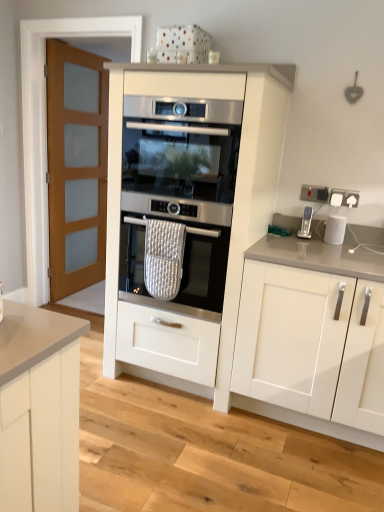
What do you see at coordinates (187, 211) in the screenshot? I see `white matte oven at center, which ranks as the 2th cabinetry in right-to-left order` at bounding box center [187, 211].

In order to face satin silver oven at center, placed as the second oven when sorted from top to bottom, should I rotate leftwards or rightwards?

A 0.328 degree turn to the left will do.

What is the approximate height of white matte cabinet at right, the 2th cabinetry from the left?

It is 38.81 inches.

Identify the location of white matte oven at center, the 1th cabinetry when ordered from left to right. click(187, 211).

From the image's perspective, is stainless steel oven at center, which is the second oven in bottom-to-top order, on white matte cabinet at right, the 2th cabinetry from the left?

Indeed, from the image's perspective, stainless steel oven at center, which is the second oven in bottom-to-top order, is shown above white matte cabinet at right, the 2th cabinetry from the left.

Visually, is stainless steel oven at center, which is the second oven in bottom-to-top order, positioned to the left or to the right of white matte cabinet at right, the 2th cabinetry from the left?

Clearly, stainless steel oven at center, which is the second oven in bottom-to-top order, is on the left of white matte cabinet at right, the 2th cabinetry from the left, in the image.

Between stainless steel oven at center, arranged as the 1th oven when viewed from the top, and white matte cabinet at right, the 2th cabinetry from the left, which one is positioned behind?

stainless steel oven at center, arranged as the 1th oven when viewed from the top, is further from the camera.

Can you confirm if white glossy kettle at upper right is positioned to the left of white matte oven at center, the 1th cabinetry when ordered from left to right?

No, white glossy kettle at upper right is not to the left of white matte oven at center, the 1th cabinetry when ordered from left to right.

Based on the photo, can you see white glossy kettle at upper right touching white matte oven at center, which ranks as the 2th cabinetry in right-to-left order?

They are not placed beside each other.

Does white glossy kettle at upper right have a smaller size compared to white matte oven at center, which ranks as the 2th cabinetry in right-to-left order?

Indeed, white glossy kettle at upper right has a smaller size compared to white matte oven at center, which ranks as the 2th cabinetry in right-to-left order.

How many degrees apart are the facing directions of white matte oven at center, the 1th cabinetry when ordered from left to right, and stainless steel oven at center, which is the second oven in bottom-to-top order?

There is a 0.797-degree angle between the facing directions of white matte oven at center, the 1th cabinetry when ordered from left to right, and stainless steel oven at center, which is the second oven in bottom-to-top order.

Are white matte oven at center, the 1th cabinetry when ordered from left to right, and stainless steel oven at center, which is the second oven in bottom-to-top order, located far from each other?

No, white matte oven at center, the 1th cabinetry when ordered from left to right, is in close proximity to stainless steel oven at center, which is the second oven in bottom-to-top order.

Which of these two, white matte oven at center, which ranks as the 2th cabinetry in right-to-left order, or stainless steel oven at center, arranged as the 1th oven when viewed from the top, is wider?

stainless steel oven at center, arranged as the 1th oven when viewed from the top, is wider.

From the image's perspective, which is above, white matte oven at center, the 1th cabinetry when ordered from left to right, or stainless steel oven at center, which is the second oven in bottom-to-top order?

stainless steel oven at center, which is the second oven in bottom-to-top order, is shown above in the image.

Is point (376, 272) closer to viewer compared to point (164, 162)?

Yes, point (376, 272) is in front of point (164, 162).

Does white matte cabinet at right, the 2th cabinetry from the left, have a greater width compared to stainless steel oven at center, which is the second oven in bottom-to-top order?

Yes.

Is white matte cabinet at right, the 1th cabinetry in the right-to-left sequence, bigger than stainless steel oven at center, which is the second oven in bottom-to-top order?

Correct, white matte cabinet at right, the 1th cabinetry in the right-to-left sequence, is larger in size than stainless steel oven at center, which is the second oven in bottom-to-top order.

From the image's perspective, who appears lower, white matte cabinet at right, the 2th cabinetry from the left, or satin silver oven at center, placed as the second oven when sorted from top to bottom?

white matte cabinet at right, the 2th cabinetry from the left, appears lower in the image.

You are a GUI agent. You are given a task and a screenshot of the screen. Output one action in this format:
    pyautogui.click(x=<x>, y=<y>)
    Task: Click on the 2nd oven behind the white matte cabinet at right, the 1th cabinetry in the right-to-left sequence, starting your count from the anchor
    
    Given the screenshot: What is the action you would take?
    pyautogui.click(x=184, y=252)

Can you see white matte cabinet at right, the 2th cabinetry from the left, touching satin silver oven at center, placed as the second oven when sorted from top to bottom?

No, white matte cabinet at right, the 2th cabinetry from the left, is not making contact with satin silver oven at center, placed as the second oven when sorted from top to bottom.

Is satin silver oven at center, placed as the second oven when sorted from top to bottom, a part of white matte cabinet at right, the 2th cabinetry from the left?

That's incorrect, satin silver oven at center, placed as the second oven when sorted from top to bottom, is not inside white matte cabinet at right, the 2th cabinetry from the left.

Does white glossy kettle at upper right have a greater height compared to white matte cabinet at right, the 1th cabinetry in the right-to-left sequence?

No, white glossy kettle at upper right is not taller than white matte cabinet at right, the 1th cabinetry in the right-to-left sequence.

Can you confirm if white glossy kettle at upper right is positioned to the right of white matte cabinet at right, the 2th cabinetry from the left?

Yes, white glossy kettle at upper right is to the right of white matte cabinet at right, the 2th cabinetry from the left.

From the white glossy kettle at upper right, count the 1st cabinetry to the left and point to it. Please provide its 2D coordinates.

[(307, 332)]

Is white glossy kettle at upper right located outside white matte cabinet at right, the 2th cabinetry from the left?

No.

Looking at this image, can you confirm if satin silver water dispenser at right is smaller than white matte cabinet at right, the 1th cabinetry in the right-to-left sequence?

Indeed, satin silver water dispenser at right has a smaller size compared to white matte cabinet at right, the 1th cabinetry in the right-to-left sequence.

Which is more to the left, satin silver water dispenser at right or white matte cabinet at right, the 1th cabinetry in the right-to-left sequence?

satin silver water dispenser at right is more to the left.

Is satin silver water dispenser at right looking in the opposite direction of white matte cabinet at right, the 2th cabinetry from the left?

Yes.

What are the coordinates of `the 2nd cabinetry in front of the satin silver water dispenser at right` in the screenshot? It's located at (307, 332).

From a real-world perspective, which cabinetry is the 2nd one underneath the stainless steel oven at center, arranged as the 1th oven when viewed from the top? Please provide its 2D coordinates.

[(307, 332)]

Where is `kitchen appliance on the right of white matte oven at center, the 1th cabinetry when ordered from left to right`? The height and width of the screenshot is (512, 384). kitchen appliance on the right of white matte oven at center, the 1th cabinetry when ordered from left to right is located at coordinates (335, 230).

When comparing their distances from satin silver oven at center, placed as the second oven when sorted from top to bottom, does white matte cabinet at right, the 2th cabinetry from the left, or satin silver water dispenser at right seem further?

Based on the image, satin silver water dispenser at right appears to be further to satin silver oven at center, placed as the second oven when sorted from top to bottom.

Based on their spatial positions, is satin silver oven at center, the 1th oven positioned from the bottom, or white glossy kettle at upper right further from white matte cabinet at right, the 2th cabinetry from the left?

white glossy kettle at upper right is further to white matte cabinet at right, the 2th cabinetry from the left.

Which object lies further to the anchor point white matte oven at center, which ranks as the 2th cabinetry in right-to-left order, stainless steel oven at center, which is the second oven in bottom-to-top order, or white glossy kettle at upper right?

Among the two, white glossy kettle at upper right is located further to white matte oven at center, which ranks as the 2th cabinetry in right-to-left order.

Looking at this image, estimate the real-world distances between objects in this image. Which object is further from white glossy kettle at upper right, satin silver oven at center, the 1th oven positioned from the bottom, or white matte oven at center, which ranks as the 2th cabinetry in right-to-left order?

white matte oven at center, which ranks as the 2th cabinetry in right-to-left order, is positioned further to the anchor white glossy kettle at upper right.

Considering their positions, is white glossy kettle at upper right positioned closer to stainless steel oven at center, which is the second oven in bottom-to-top order, than satin silver oven at center, placed as the second oven when sorted from top to bottom?

The object closer to stainless steel oven at center, which is the second oven in bottom-to-top order, is satin silver oven at center, placed as the second oven when sorted from top to bottom.

Based on their spatial positions, is satin silver water dispenser at right or satin silver oven at center, the 1th oven positioned from the bottom, further from white glossy kettle at upper right?

satin silver oven at center, the 1th oven positioned from the bottom.

Which object lies further to the anchor point white matte cabinet at right, the 1th cabinetry in the right-to-left sequence, satin silver water dispenser at right or white glossy kettle at upper right?

white glossy kettle at upper right lies further to white matte cabinet at right, the 1th cabinetry in the right-to-left sequence, than the other object.

Looking at the image, which one is located closer to white matte cabinet at right, the 1th cabinetry in the right-to-left sequence, stainless steel oven at center, arranged as the 1th oven when viewed from the top, or white glossy kettle at upper right?

white glossy kettle at upper right is closer to white matte cabinet at right, the 1th cabinetry in the right-to-left sequence.

I want to click on oven between stainless steel oven at center, arranged as the 1th oven when viewed from the top, and white matte cabinet at right, the 2th cabinetry from the left, in the up-down direction, so click(x=184, y=252).

Locate an element on the screen. The width and height of the screenshot is (384, 512). cabinetry that lies between stainless steel oven at center, arranged as the 1th oven when viewed from the top, and white matte cabinet at right, the 2th cabinetry from the left, from top to bottom is located at coordinates (187, 211).

This screenshot has width=384, height=512. I want to click on home appliance between white matte oven at center, the 1th cabinetry when ordered from left to right, and white matte cabinet at right, the 1th cabinetry in the right-to-left sequence, from left to right, so click(x=306, y=224).

The height and width of the screenshot is (512, 384). I want to click on cabinetry that lies between stainless steel oven at center, which is the second oven in bottom-to-top order, and satin silver oven at center, placed as the second oven when sorted from top to bottom, from top to bottom, so click(x=187, y=211).